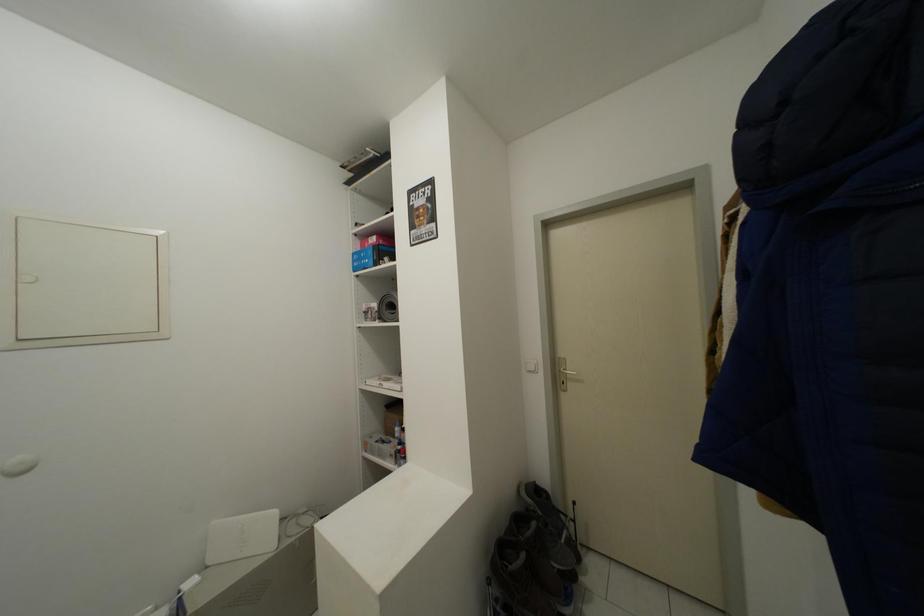
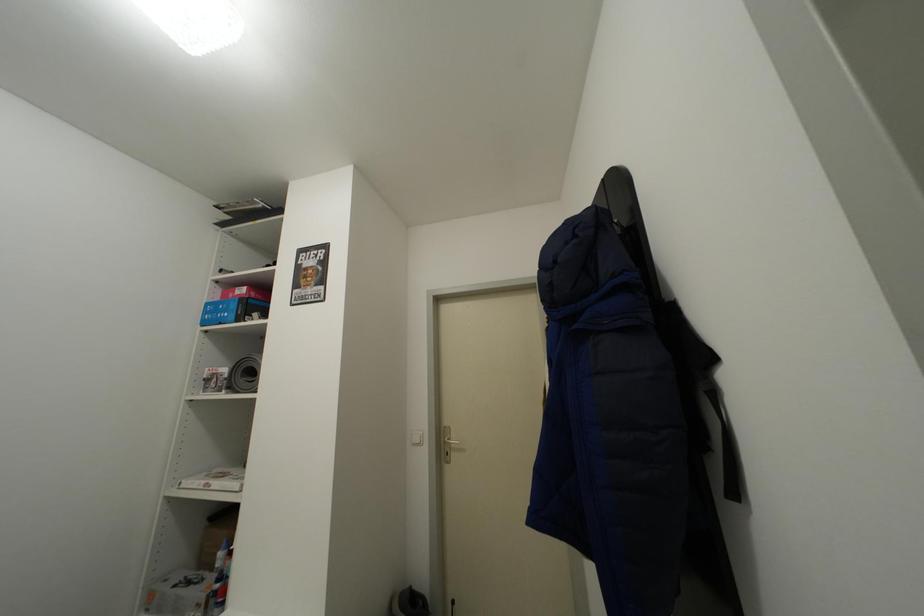
Question: The first image is from the beginning of the video and the second image is from the end. How did the camera likely rotate when shooting the video?

Choices:
 (A) Left
 (B) Right
 (C) Up
 (D) Down

Answer: (B)